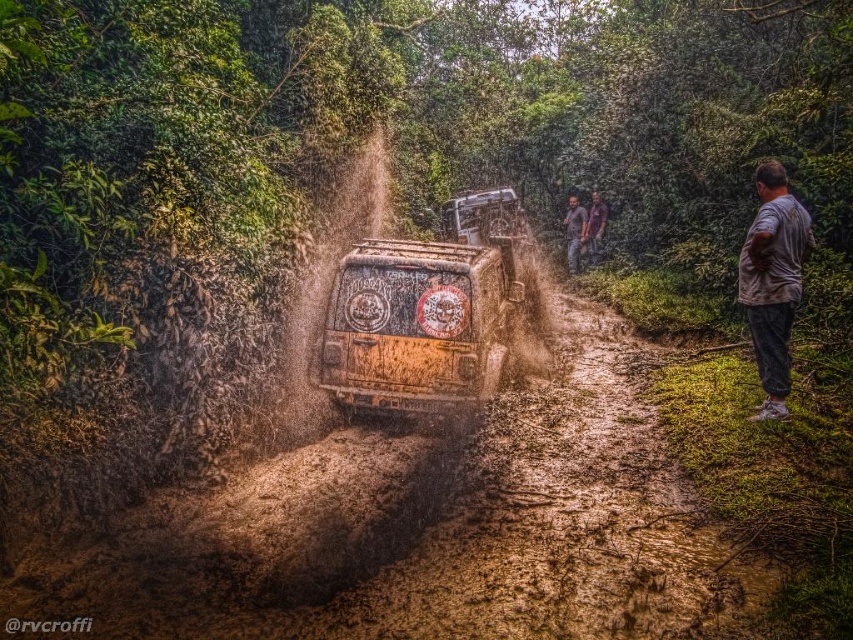
You are a photographer trying to capture the rusty metallic truck at center and the brown fabric shirt at upper center in a single shot. Which object should you focus on first to ensure both are in frame?

The rusty metallic truck at center is bigger than the brown fabric shirt at upper center, so you should focus on the rusty metallic truck at center first to ensure both are in frame.

You are a photographer trying to capture the brown textured shirt at upper center in your shot. Where should you position your camera to ensure the shirt is centered in the frame?

The brown textured shirt at upper center is located at coordinates 0.362 on the x axis and 0.674 on the y axis, so position your camera to center the frame at those coordinates to capture it precisely.